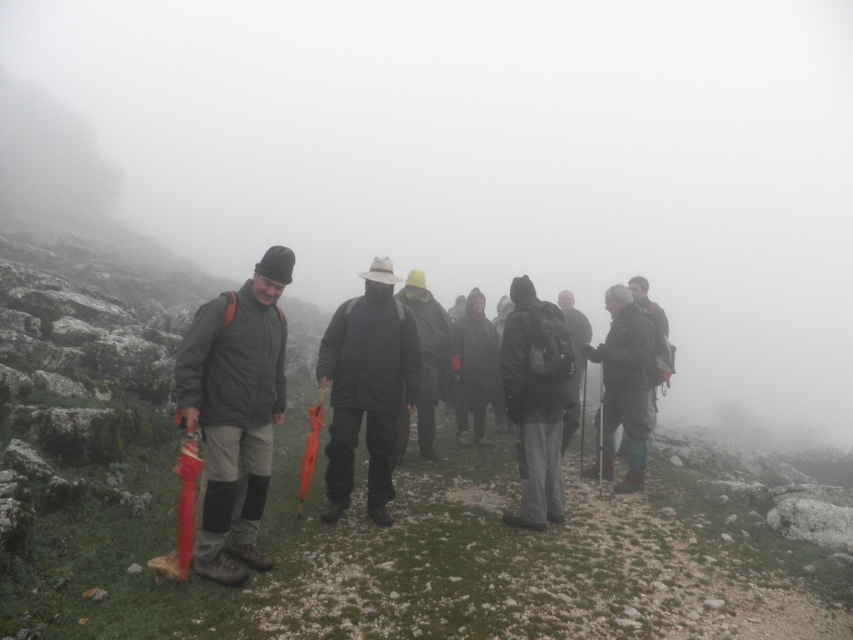
Between matte gray jacket at left and black matte jacket at center, which one appears on the right side from the viewer's perspective?

black matte jacket at center is more to the right.

Is the position of matte gray jacket at left more distant than that of black matte jacket at center?

No, it is not.

Identify the location of matte gray jacket at left. (235, 412).

Is matte black backpack at center to the right of matte black jacket at center from the viewer's perspective?

No, matte black backpack at center is not to the right of matte black jacket at center.

Does matte black backpack at center have a smaller size compared to matte black jacket at center?

Yes.

Who is more forward, [538,477] or [564,416]?

Point [538,477] is in front.

Where is `matte black backpack at center`? This screenshot has width=853, height=640. matte black backpack at center is located at coordinates (537, 401).

How far apart are dark gray fabric jacket at center and matte black jacket at center?

dark gray fabric jacket at center is 24.63 inches from matte black jacket at center.

Identify the location of dark gray fabric jacket at center. The image size is (853, 640). (624, 387).